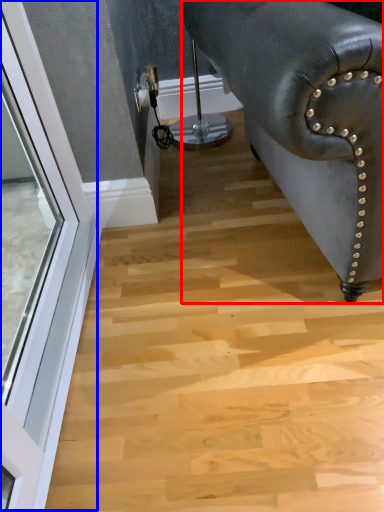
Question: Which point is closer to the camera, furniture (highlighted by a red box) or window (highlighted by a blue box)?

Choices:
 (A) furniture
 (B) window

Answer: (A)